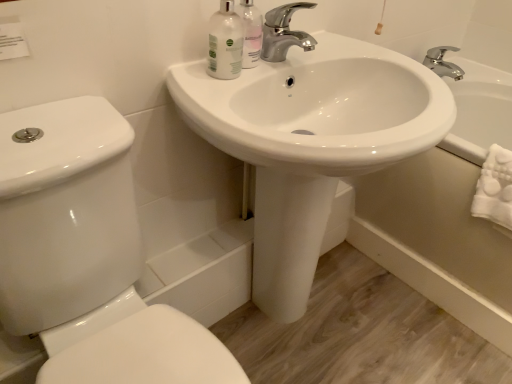
Question: Considering the relative sizes of white glossy sink at center and white glossy bathtub at lower right in the image provided, is white glossy sink at center shorter than white glossy bathtub at lower right?

Choices:
 (A) yes
 (B) no

Answer: (B)

Question: From the image's perspective, would you say white glossy sink at center is positioned over white glossy bathtub at lower right?

Choices:
 (A) no
 (B) yes

Answer: (A)

Question: Is white glossy bathtub at lower right at the back of white glossy sink at center?

Choices:
 (A) no
 (B) yes

Answer: (A)

Question: Can you confirm if white glossy sink at center is taller than white glossy bathtub at lower right?

Choices:
 (A) yes
 (B) no

Answer: (A)

Question: From a real-world perspective, is white glossy sink at center on top of white glossy bathtub at lower right?

Choices:
 (A) yes
 (B) no

Answer: (A)

Question: Does white glossy sink at center have a smaller size compared to white glossy bathtub at lower right?

Choices:
 (A) yes
 (B) no

Answer: (A)

Question: From the image's perspective, is white glossy bathtub at lower right located beneath white glossy sink at center?

Choices:
 (A) yes
 (B) no

Answer: (B)

Question: Could you tell me if white glossy bathtub at lower right is facing white glossy sink at center?

Choices:
 (A) no
 (B) yes

Answer: (B)

Question: Is white glossy bathtub at lower right positioned before white glossy sink at center?

Choices:
 (A) no
 (B) yes

Answer: (A)

Question: Is white glossy bathtub at lower right not close to white glossy sink at center?

Choices:
 (A) yes
 (B) no

Answer: (B)

Question: Is white glossy sink at center completely or partially inside white glossy bathtub at lower right?

Choices:
 (A) no
 (B) yes

Answer: (A)

Question: From a real-world perspective, is white glossy bathtub at lower right positioned under white glossy sink at center based on gravity?

Choices:
 (A) no
 (B) yes

Answer: (B)

Question: Does white glossy bottle at upper center, acting as the 2th mouthwash starting from the right, come behind white glossy toilet at lower left?

Choices:
 (A) no
 (B) yes

Answer: (B)